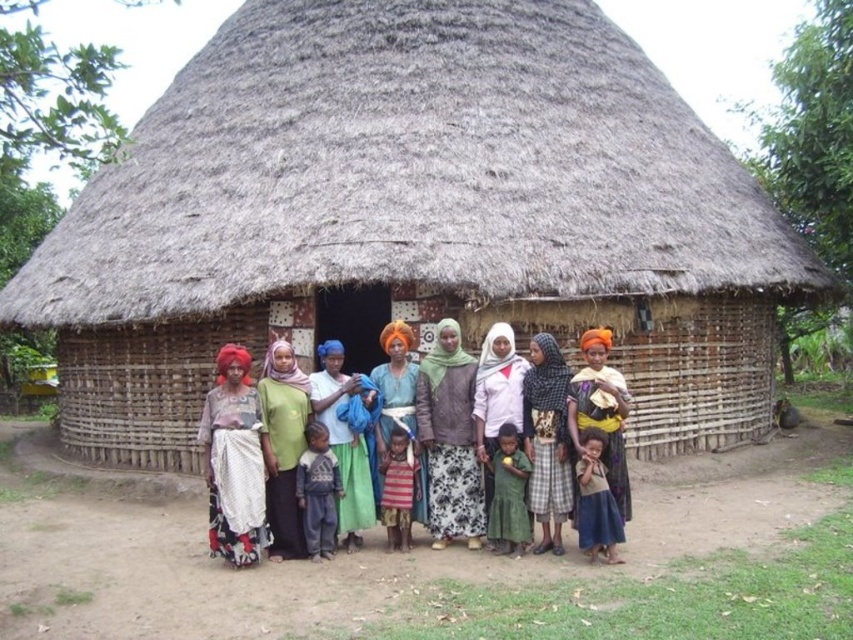
You are a photographer standing at the entrance of the thatched hut. You want to take a photo that includes both the white cotton dress at center and the light brown fabric dress at lower right. Can you capture both in a single frame without moving your position? Explain why or why not based on their distance apart.

The white cotton dress at center is 3.41 feet away from the light brown fabric dress at lower right. Since the distance between them is relatively small, it is likely possible to capture both in a single frame without moving your position, provided the camera lens has an appropriate angle of view to encompass the space between them.

You are a photographer trying to capture a group photo of the adults and children in front of the thatched hut. You want to ensure that both the green fabric at center and the orange fabric headscarf at center are clearly visible in the frame. Given that your camera has a maximum focus range of 3.5 meters, will you be able to capture both objects in focus simultaneously?

The distance between the green fabric at center and the orange fabric headscarf at center is 3.70 meters. Since the camera can only focus within 3.5 meters, the two objects are slightly out of the focus range. You might need to adjust your position or use a different camera setting to ensure both are in focus.